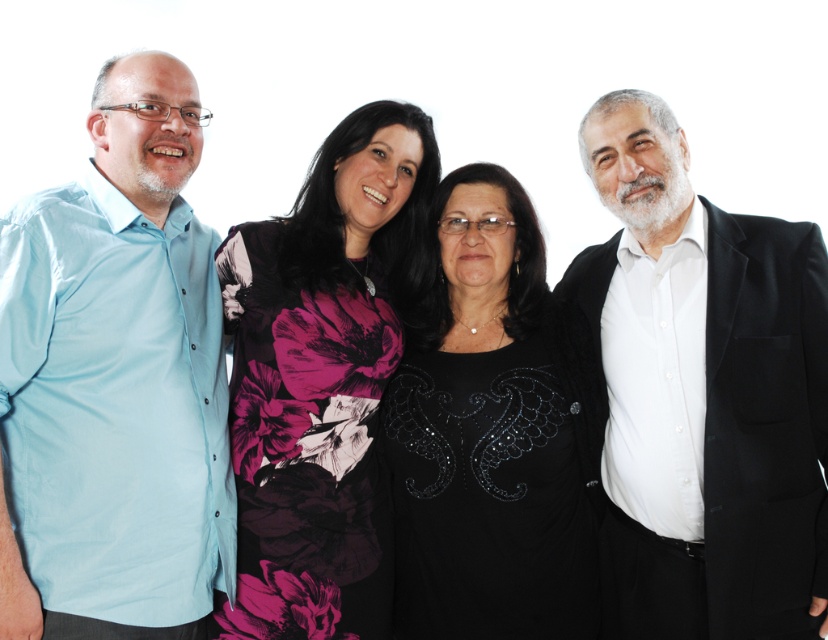
You are standing in front of the group photo and want to touch the point at point (347,548) and point (556,579). Which point is closer to you?

Point (347,548) is closer to the camera than point (556,579), so the point at (347,548) is closer to you.